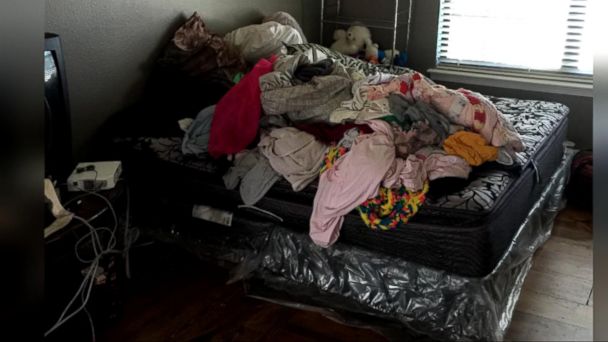
Find the location of a particular element. video game console is located at coordinates (104, 173).